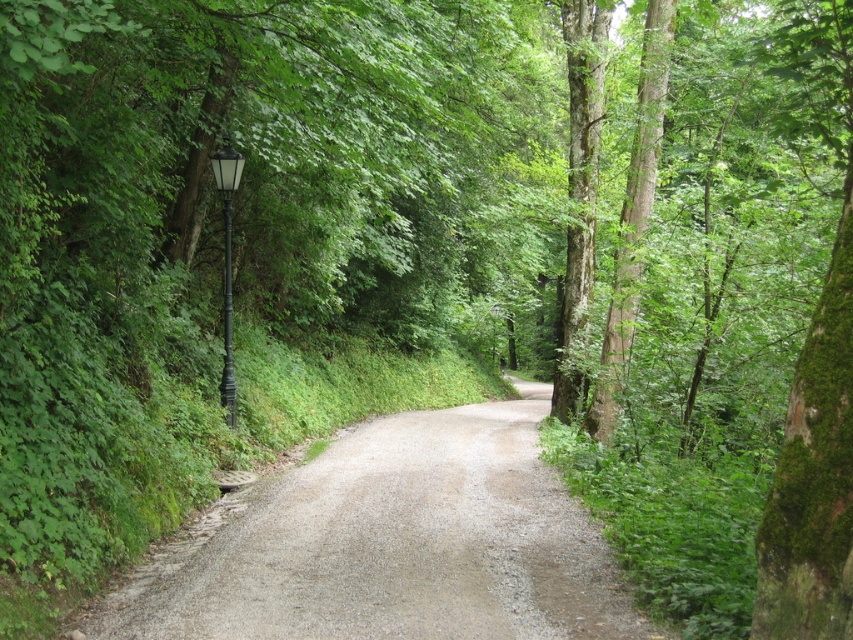
Question: Estimate the real-world distances between objects in this image. Which object is closer to the black metal lamp post at left?

Choices:
 (A) gray gravel trail at center
 (B) green rough bark tree at center

Answer: (A)

Question: Which of these objects is positioned closest to the gray gravel trail at center?

Choices:
 (A) black metal lamp post at left
 (B) green rough bark tree at center

Answer: (A)

Question: Does gray gravel trail at center appear over black metal lamp post at left?

Choices:
 (A) yes
 (B) no

Answer: (B)

Question: Does gray gravel trail at center appear under green rough bark tree at center?

Choices:
 (A) no
 (B) yes

Answer: (B)

Question: Which of the following is the closest to the observer?

Choices:
 (A) (428, 532)
 (B) (215, 154)

Answer: (A)

Question: Observing the image, what is the correct spatial positioning of green rough bark tree at center in reference to black metal lamp post at left?

Choices:
 (A) right
 (B) left

Answer: (A)